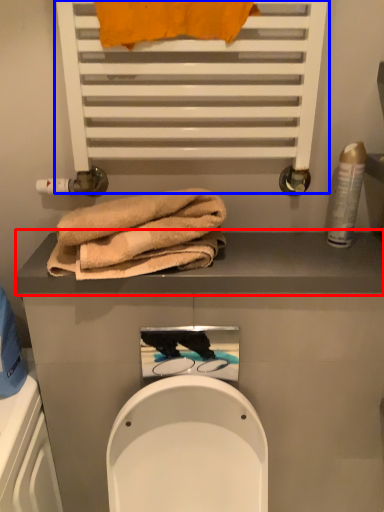
Question: Which object appears closest to the camera in this image, balustrade (highlighted by a red box) or shelf (highlighted by a blue box)?

Choices:
 (A) balustrade
 (B) shelf

Answer: (B)